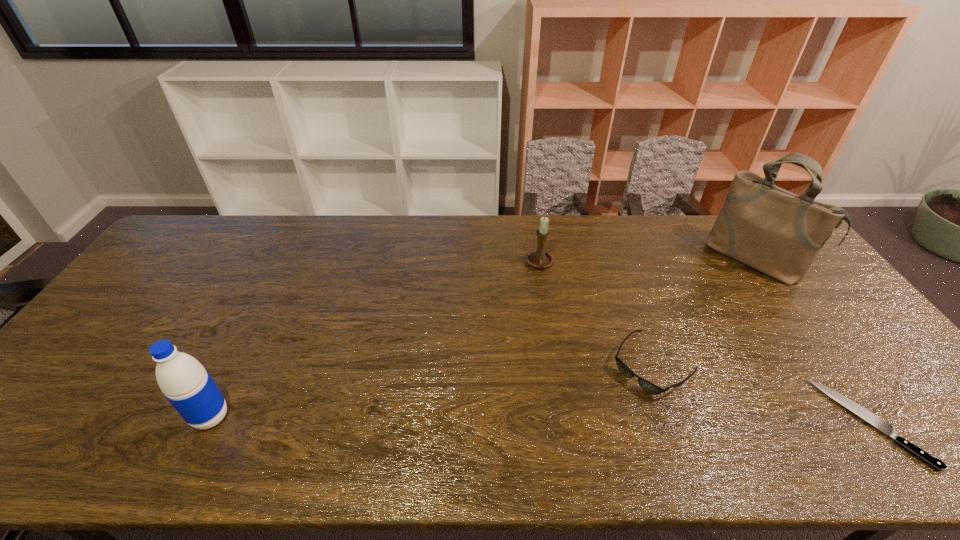
The width and height of the screenshot is (960, 540). I want to click on the second tallest object, so click(187, 385).

This screenshot has width=960, height=540. What are the coordinates of `water bottle` in the screenshot? It's located at (187, 385).

Image resolution: width=960 pixels, height=540 pixels. In order to click on steak knife in this screenshot , I will do `click(887, 428)`.

Locate an element on the screen. sunglasses is located at coordinates (649, 387).

Locate an element on the screen. the third object from left to right is located at coordinates (649, 387).

Identify the location of the fourth object from right to left. (539, 258).

Where is `candle holder`? candle holder is located at coordinates (539, 258).

Find the location of a particular element. The height and width of the screenshot is (540, 960). shoulder bag is located at coordinates (779, 233).

Image resolution: width=960 pixels, height=540 pixels. Identify the location of vacant space situated 0.230m on the left of the leftmost object. (93, 417).

Where is `vacant space situated on the left of the steak knife`? vacant space situated on the left of the steak knife is located at coordinates (693, 422).